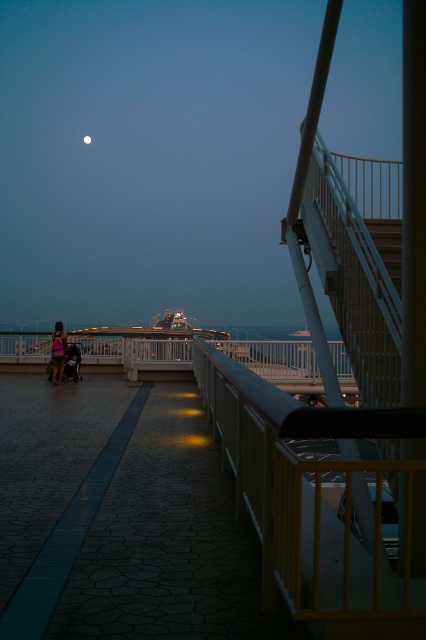
Question: Estimate the real-world distances between objects in this image. Which object is closer to the yellow matte balustrade at center?

Choices:
 (A) bright silver moon at upper center
 (B) matte black jacket at left

Answer: (B)

Question: Which object is farther from the camera taking this photo?

Choices:
 (A) matte black jacket at left
 (B) bright silver moon at upper center

Answer: (B)

Question: Can you confirm if yellow matte balustrade at center is positioned to the right of bright silver moon at upper center?

Choices:
 (A) yes
 (B) no

Answer: (A)

Question: Does matte black jacket at left appear over bright silver moon at upper center?

Choices:
 (A) yes
 (B) no

Answer: (B)

Question: Which point is closer to the camera?

Choices:
 (A) (60, 368)
 (B) (86, 138)

Answer: (A)

Question: Does yellow matte balustrade at center have a smaller size compared to matte black jacket at left?

Choices:
 (A) no
 (B) yes

Answer: (A)